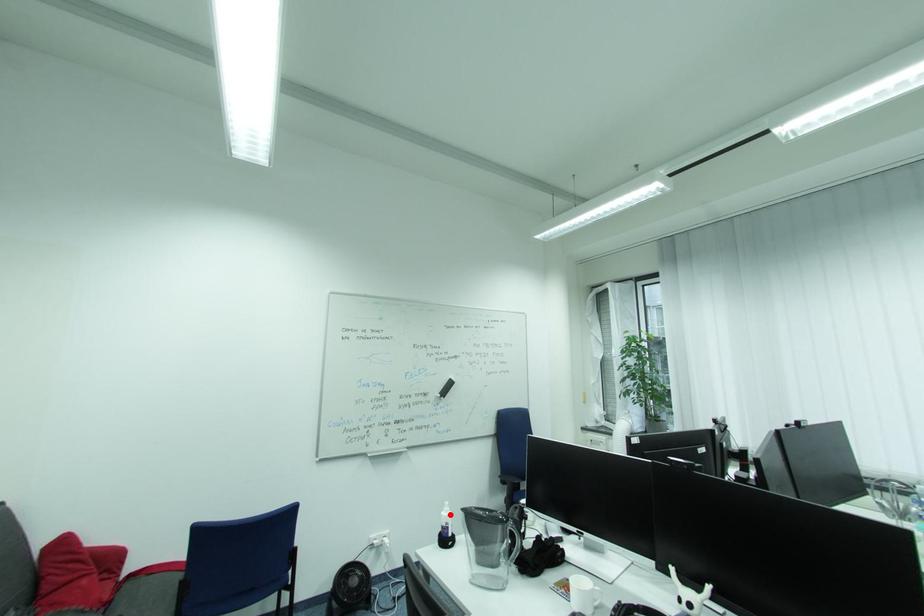
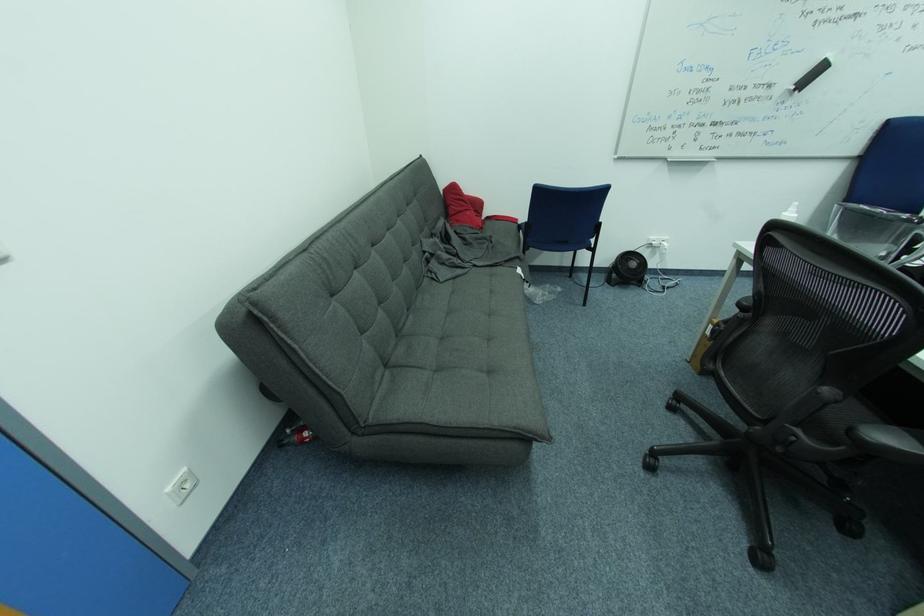
Find the pixel in the second image that matches the highlighted location in the first image.

(792, 215)